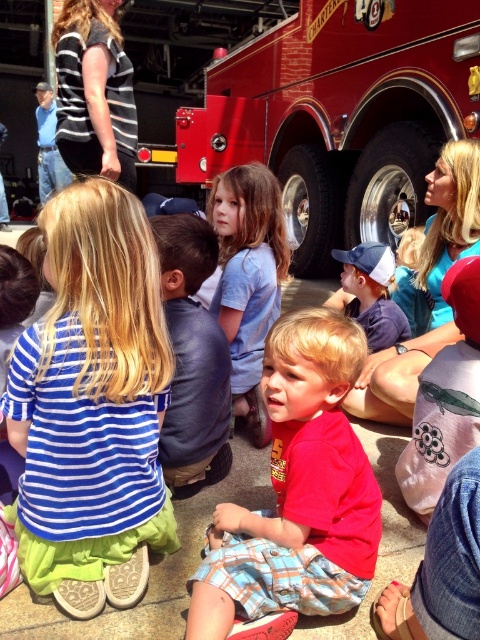
Question: Among these points, which one is farthest from the camera?

Choices:
 (A) (85, 557)
 (B) (355, 502)

Answer: (A)

Question: Among these points, which one is farthest from the camera?

Choices:
 (A) (39, 342)
 (B) (335, 403)

Answer: (B)

Question: Which of the following is the farthest from the observer?

Choices:
 (A) (278, 557)
 (B) (142, 422)
 (C) (170, 419)

Answer: (C)

Question: Is shiny red fire truck at center positioned in front of light blue cotton shirt at center?

Choices:
 (A) no
 (B) yes

Answer: (A)

Question: Is the position of blue striped shirt at center less distant than that of leather jacket at center?

Choices:
 (A) no
 (B) yes

Answer: (B)

Question: Is red cotton shirt at center bigger than leather jacket at center?

Choices:
 (A) yes
 (B) no

Answer: (A)